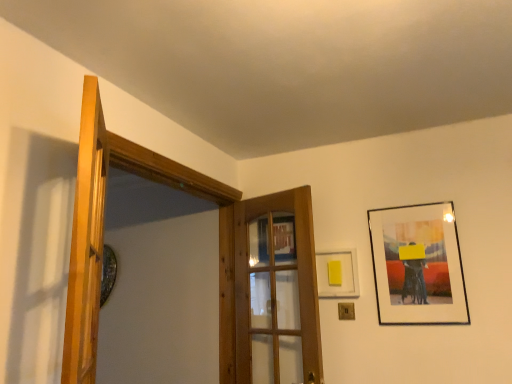
Question: From a real-world perspective, is wooden door at left, which is the 1th door in front-to-back order, positioned over yellow matte picture frame at upper right, positioned as the 2th picture frame in right-to-left order, based on gravity?

Choices:
 (A) no
 (B) yes

Answer: (B)

Question: Is wooden door at left, which is the 1th door in front-to-back order, positioned beyond the bounds of yellow matte picture frame at upper right, positioned as the 2th picture frame in right-to-left order?

Choices:
 (A) no
 (B) yes

Answer: (B)

Question: Is wooden door at left, the second door viewed from the back, at the left side of yellow matte picture frame at upper right, the first picture frame positioned from the left?

Choices:
 (A) no
 (B) yes

Answer: (B)

Question: Is wooden door at left, which is the 1th door in front-to-back order, far from yellow matte picture frame at upper right, positioned as the 2th picture frame in right-to-left order?

Choices:
 (A) yes
 (B) no

Answer: (A)

Question: Can you confirm if wooden door at left, which is the first door in left-to-right order, is bigger than yellow matte picture frame at upper right, positioned as the 2th picture frame in right-to-left order?

Choices:
 (A) yes
 (B) no

Answer: (A)

Question: Is wooden door at left, the second door from the right, taller than yellow matte picture frame at upper right, the first picture frame positioned from the left?

Choices:
 (A) yes
 (B) no

Answer: (A)

Question: Does wooden door at center, which is the first door from back to front, have a greater width compared to wooden door at left, the second door from the right?

Choices:
 (A) no
 (B) yes

Answer: (A)

Question: Is wooden door at center, acting as the 1th door starting from the right, taller than wooden door at left, which is the 1th door in front-to-back order?

Choices:
 (A) yes
 (B) no

Answer: (A)

Question: From a real-world perspective, is wooden door at center, arranged as the 2th door when viewed from the front, below wooden door at left, the second door from the right?

Choices:
 (A) no
 (B) yes

Answer: (B)

Question: From the image's perspective, is wooden door at center, which is the first door from back to front, over wooden door at left, the second door from the right?

Choices:
 (A) no
 (B) yes

Answer: (A)

Question: Is wooden door at center, which is the first door from back to front, to the right of wooden door at left, which is the 1th door in front-to-back order, from the viewer's perspective?

Choices:
 (A) no
 (B) yes

Answer: (B)

Question: Is the depth of wooden door at center, which is the first door from back to front, less than that of wooden door at left, which is the 1th door in front-to-back order?

Choices:
 (A) yes
 (B) no

Answer: (B)

Question: Can you confirm if matte black picture frame at upper right, which is the first picture frame in right-to-left order, is bigger than wooden door at center, acting as the 1th door starting from the right?

Choices:
 (A) yes
 (B) no

Answer: (B)